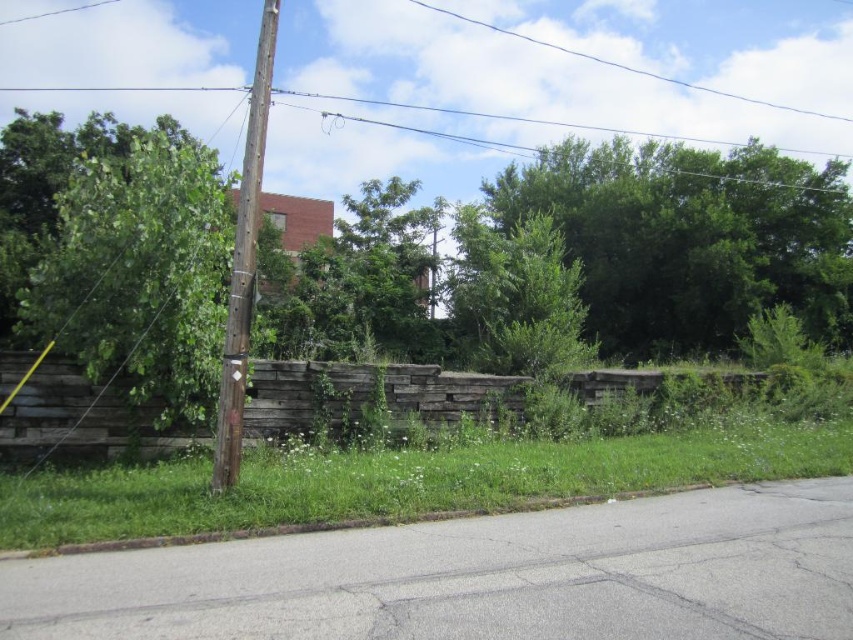
Question: Which point is closer to the camera taking this photo?

Choices:
 (A) (653, 264)
 (B) (219, 442)

Answer: (B)

Question: Does green leafy tree at upper center have a lesser width compared to weathered wood fence at center?

Choices:
 (A) no
 (B) yes

Answer: (A)

Question: Is weathered wood fence at center above green leafy tree at center?

Choices:
 (A) no
 (B) yes

Answer: (A)

Question: Can you confirm if green leafy tree at upper center is positioned to the right of green grass at center?

Choices:
 (A) yes
 (B) no

Answer: (A)

Question: Which point is closer to the camera taking this photo?

Choices:
 (A) (318, 314)
 (B) (248, 200)
 (C) (61, 381)
 (D) (503, 500)

Answer: (B)

Question: Among these objects, which one is farthest from the camera?

Choices:
 (A) brown wooden telegraph pole at center-left
 (B) weathered wood fence at center
 (C) green leafy tree at center

Answer: (C)